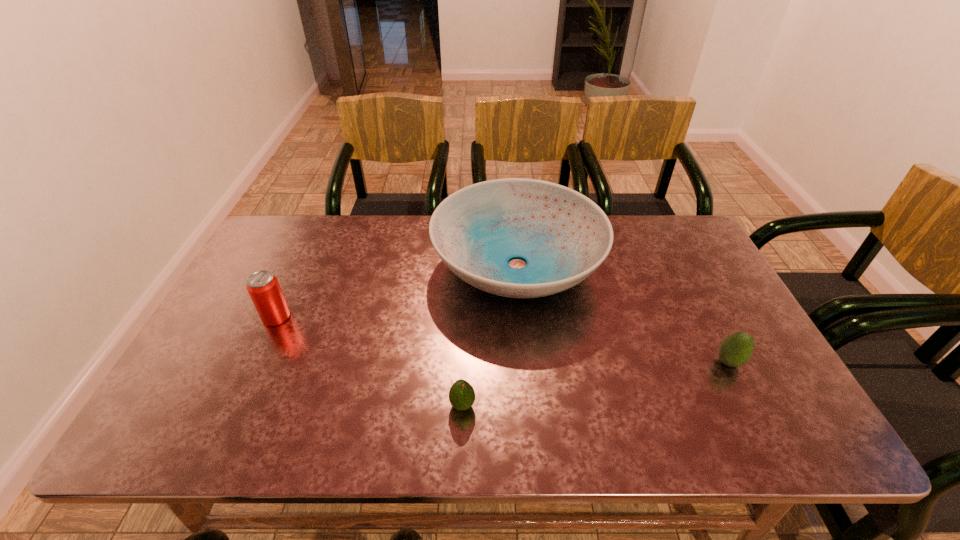
Locate an element on the screen. object present at the far edge is located at coordinates (563, 236).

Locate an element on the screen. The image size is (960, 540). object at the near edge is located at coordinates (461, 395).

Identify the location of object at the left edge. The width and height of the screenshot is (960, 540). (263, 287).

Image resolution: width=960 pixels, height=540 pixels. Identify the location of object that is at the right edge. (735, 350).

What are the coordinates of `vacant space at the far edge` in the screenshot? It's located at (398, 253).

The image size is (960, 540). In order to click on vacant space at the near edge of the desktop in this screenshot , I will do `click(592, 426)`.

This screenshot has height=540, width=960. In the image, there is a desktop. Find the location of `vacant space at the left edge`. vacant space at the left edge is located at coordinates (207, 343).

Where is `free space at the right edge of the desktop`? The image size is (960, 540). free space at the right edge of the desktop is located at coordinates (689, 325).

Locate an element on the screen. blank area at the far right corner is located at coordinates (683, 239).

The height and width of the screenshot is (540, 960). In order to click on vacant space at the near right corner of the desktop in this screenshot , I will do `click(752, 439)`.